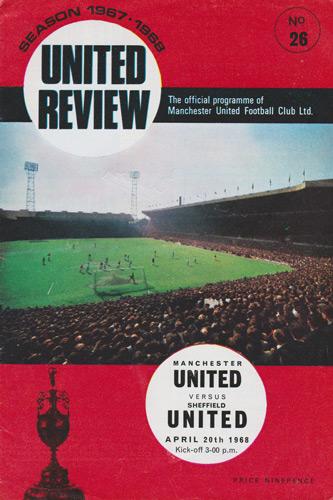
Where is `trophy`? The image size is (333, 500). trophy is located at coordinates (48, 435).